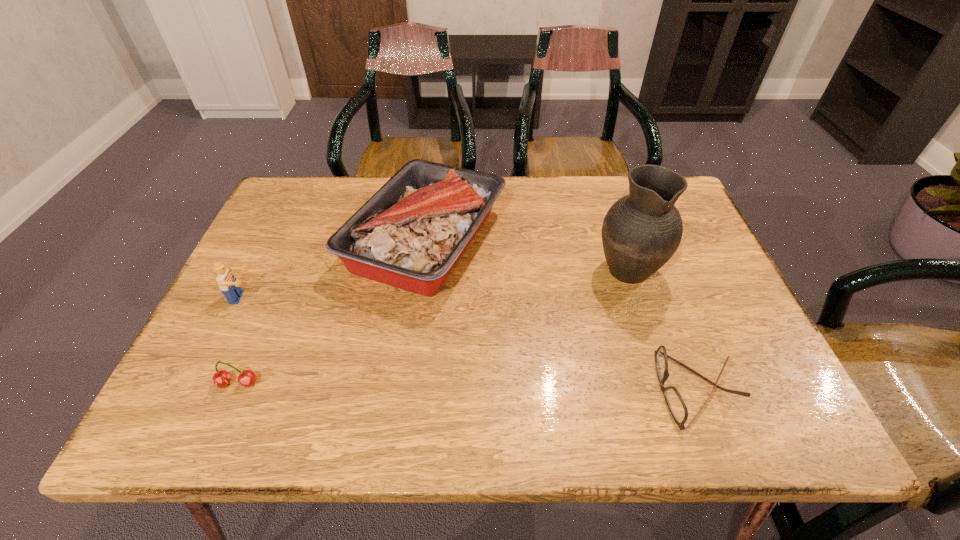
In order to click on free space between the leftmost object and the tray in this screenshot , I will do `click(335, 268)`.

Where is `the fourth closest object relative to the leftmost object`? This screenshot has width=960, height=540. the fourth closest object relative to the leftmost object is located at coordinates (677, 407).

This screenshot has width=960, height=540. Find the location of `the second closest object relative to the fourth tallest object`. the second closest object relative to the fourth tallest object is located at coordinates (410, 234).